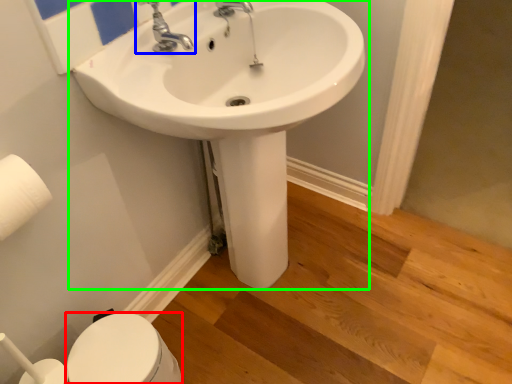
Question: Considering the real-world distances, which object is farthest from bidet (highlighted by a red box)? tap (highlighted by a blue box) or sink (highlighted by a green box)?

Choices:
 (A) tap
 (B) sink

Answer: (A)